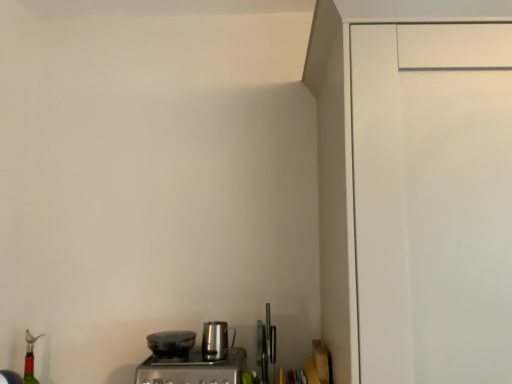
The image size is (512, 384). What do you see at coordinates (30, 359) in the screenshot?
I see `translucent red glass bottle at lower left` at bounding box center [30, 359].

What is the approximate height of translucent red glass bottle at lower left?

16.38 inches.

Measure the distance between stainless steel kettle at center, which appears as the first kitchen appliance when viewed from the right, and camera.

stainless steel kettle at center, which appears as the first kitchen appliance when viewed from the right, is 4.30 feet from camera.

Where is `stainless steel kettle at center, arranged as the 2th kitchen appliance when viewed from the left`? This screenshot has width=512, height=384. stainless steel kettle at center, arranged as the 2th kitchen appliance when viewed from the left is located at coordinates (216, 340).

I want to click on shiny black pot at lower center, the 2th kitchen appliance in the right-to-left sequence, so click(170, 344).

The image size is (512, 384). In order to click on translucent red glass bottle at lower left in this screenshot , I will do `click(30, 359)`.

Which object is thinner, translucent red glass bottle at lower left or stainless steel coffee maker at lower center?

With smaller width is translucent red glass bottle at lower left.

Is point (25, 337) closer or farther from the camera than point (155, 360)?

Clearly, point (25, 337) is more distant from the camera than point (155, 360).

This screenshot has width=512, height=384. In order to click on bottle below the stainless steel coffee maker at lower center (from the image's perspective) in this screenshot , I will do `click(30, 359)`.

Can you confirm if translucent red glass bottle at lower left is shorter than stainless steel coffee maker at lower center?

No, translucent red glass bottle at lower left is not shorter than stainless steel coffee maker at lower center.

Which is further, (156, 347) or (32, 382)?

Point (32, 382)

From a real-world perspective, between shiny black pot at lower center, placed as the first kitchen appliance when sorted from left to right, and translucent red glass bottle at lower left, who is vertically lower?

translucent red glass bottle at lower left.

From the image's perspective, count 1st kitchen appliances upward from the translucent red glass bottle at lower left and point to it. Please provide its 2D coordinates.

[(170, 344)]

Which of these two, translucent red glass bottle at lower left or shiny black pot at lower center, placed as the first kitchen appliance when sorted from left to right, stands taller?

translucent red glass bottle at lower left is taller.

Which is less distant, (29,348) or (153,344)?

Point (29,348) is farther from the camera than point (153,344).

Between translucent red glass bottle at lower left and shiny black pot at lower center, the 2th kitchen appliance in the right-to-left sequence, which one has larger size?

With larger size is translucent red glass bottle at lower left.

Is translucent red glass bottle at lower left completely or partially outside of shiny black pot at lower center, placed as the first kitchen appliance when sorted from left to right?

Absolutely, translucent red glass bottle at lower left is external to shiny black pot at lower center, placed as the first kitchen appliance when sorted from left to right.

Is translucent red glass bottle at lower left surrounded by stainless steel coffee maker at lower center?

No, translucent red glass bottle at lower left is located outside of stainless steel coffee maker at lower center.

Is stainless steel coffee maker at lower center aimed at translucent red glass bottle at lower left?

No, stainless steel coffee maker at lower center is not turned towards translucent red glass bottle at lower left.

Does stainless steel coffee maker at lower center have a greater width compared to translucent red glass bottle at lower left?

Indeed, stainless steel coffee maker at lower center has a greater width compared to translucent red glass bottle at lower left.

Who is shorter, stainless steel coffee maker at lower center or translucent red glass bottle at lower left?

Standing shorter between the two is stainless steel coffee maker at lower center.

This screenshot has width=512, height=384. I want to click on bottle below the stainless steel kettle at center, arranged as the 2th kitchen appliance when viewed from the left (from a real-world perspective), so click(30, 359).

Which is more to the left, stainless steel kettle at center, which appears as the first kitchen appliance when viewed from the right, or translucent red glass bottle at lower left?

translucent red glass bottle at lower left is more to the left.

In the scene shown: Considering their positions, is stainless steel kettle at center, which appears as the first kitchen appliance when viewed from the right, located in front of or behind translucent red glass bottle at lower left?

Visually, stainless steel kettle at center, which appears as the first kitchen appliance when viewed from the right, is located in front of translucent red glass bottle at lower left.

Which of these two, stainless steel kettle at center, arranged as the 2th kitchen appliance when viewed from the left, or translucent red glass bottle at lower left, stands shorter?

stainless steel kettle at center, arranged as the 2th kitchen appliance when viewed from the left, is shorter.

From the image's perspective, is shiny black pot at lower center, placed as the first kitchen appliance when sorted from left to right, positioned above or below stainless steel coffee maker at lower center?

shiny black pot at lower center, placed as the first kitchen appliance when sorted from left to right, is above stainless steel coffee maker at lower center.

Which object is further away from the camera, shiny black pot at lower center, placed as the first kitchen appliance when sorted from left to right, or stainless steel coffee maker at lower center?

shiny black pot at lower center, placed as the first kitchen appliance when sorted from left to right.

Is shiny black pot at lower center, placed as the first kitchen appliance when sorted from left to right, facing towards stainless steel coffee maker at lower center?

No, shiny black pot at lower center, placed as the first kitchen appliance when sorted from left to right, is not aimed at stainless steel coffee maker at lower center.

Between shiny black pot at lower center, placed as the first kitchen appliance when sorted from left to right, and stainless steel coffee maker at lower center, which one appears on the left side from the viewer's perspective?

shiny black pot at lower center, placed as the first kitchen appliance when sorted from left to right.

Considering the sizes of objects shiny black pot at lower center, the 2th kitchen appliance in the right-to-left sequence, and stainless steel kettle at center, which appears as the first kitchen appliance when viewed from the right, in the image provided, who is shorter, shiny black pot at lower center, the 2th kitchen appliance in the right-to-left sequence, or stainless steel kettle at center, which appears as the first kitchen appliance when viewed from the right,?

shiny black pot at lower center, the 2th kitchen appliance in the right-to-left sequence.

Considering the positions of objects shiny black pot at lower center, the 2th kitchen appliance in the right-to-left sequence, and stainless steel kettle at center, arranged as the 2th kitchen appliance when viewed from the left, in the image provided, who is more to the right, shiny black pot at lower center, the 2th kitchen appliance in the right-to-left sequence, or stainless steel kettle at center, arranged as the 2th kitchen appliance when viewed from the left,?

stainless steel kettle at center, arranged as the 2th kitchen appliance when viewed from the left, is more to the right.

How distant is shiny black pot at lower center, the 2th kitchen appliance in the right-to-left sequence, from stainless steel kettle at center, which appears as the first kitchen appliance when viewed from the right?

3.90 inches.

Is shiny black pot at lower center, the 2th kitchen appliance in the right-to-left sequence, not close to stainless steel kettle at center, which appears as the first kitchen appliance when viewed from the right?

Actually, shiny black pot at lower center, the 2th kitchen appliance in the right-to-left sequence, and stainless steel kettle at center, which appears as the first kitchen appliance when viewed from the right, are a little close together.

The width and height of the screenshot is (512, 384). I want to click on home appliance above the translucent red glass bottle at lower left (from the image's perspective), so click(x=193, y=369).

Find the location of a particular element. This screenshot has width=512, height=384. bottle on the left of shiny black pot at lower center, placed as the first kitchen appliance when sorted from left to right is located at coordinates (30, 359).

Based on their spatial positions, is translucent red glass bottle at lower left or stainless steel kettle at center, which appears as the first kitchen appliance when viewed from the right, closer to stainless steel coffee maker at lower center?

stainless steel kettle at center, which appears as the first kitchen appliance when viewed from the right, lies closer to stainless steel coffee maker at lower center than the other object.

Based on their spatial positions, is stainless steel coffee maker at lower center or stainless steel kettle at center, which appears as the first kitchen appliance when viewed from the right, further from translucent red glass bottle at lower left?

stainless steel kettle at center, which appears as the first kitchen appliance when viewed from the right, lies further to translucent red glass bottle at lower left than the other object.

Looking at the image, which one is located closer to translucent red glass bottle at lower left, shiny black pot at lower center, the 2th kitchen appliance in the right-to-left sequence, or stainless steel coffee maker at lower center?

shiny black pot at lower center, the 2th kitchen appliance in the right-to-left sequence.

Estimate the real-world distances between objects in this image. Which object is closer to translucent red glass bottle at lower left, stainless steel kettle at center, which appears as the first kitchen appliance when viewed from the right, or stainless steel coffee maker at lower center?

stainless steel coffee maker at lower center is positioned closer to the anchor translucent red glass bottle at lower left.

Which object lies nearer to the anchor point shiny black pot at lower center, the 2th kitchen appliance in the right-to-left sequence, stainless steel kettle at center, which appears as the first kitchen appliance when viewed from the right, or translucent red glass bottle at lower left?

Among the two, stainless steel kettle at center, which appears as the first kitchen appliance when viewed from the right, is located nearer to shiny black pot at lower center, the 2th kitchen appliance in the right-to-left sequence.

Which object lies further to the anchor point shiny black pot at lower center, placed as the first kitchen appliance when sorted from left to right, stainless steel kettle at center, which appears as the first kitchen appliance when viewed from the right, or stainless steel coffee maker at lower center?

The object further to shiny black pot at lower center, placed as the first kitchen appliance when sorted from left to right, is stainless steel kettle at center, which appears as the first kitchen appliance when viewed from the right.

When comparing their distances from stainless steel kettle at center, arranged as the 2th kitchen appliance when viewed from the left, does translucent red glass bottle at lower left or shiny black pot at lower center, the 2th kitchen appliance in the right-to-left sequence, seem closer?

Based on the image, shiny black pot at lower center, the 2th kitchen appliance in the right-to-left sequence, appears to be nearer to stainless steel kettle at center, arranged as the 2th kitchen appliance when viewed from the left.

When comparing their distances from translucent red glass bottle at lower left, does stainless steel coffee maker at lower center or shiny black pot at lower center, placed as the first kitchen appliance when sorted from left to right, seem closer?

shiny black pot at lower center, placed as the first kitchen appliance when sorted from left to right, lies closer to translucent red glass bottle at lower left than the other object.

You are a GUI agent. You are given a task and a screenshot of the screen. Output one action in this format:
    pyautogui.click(x=<x>, y=<y>)
    Task: Click on the kitchen appliance located between translucent red glass bottle at lower left and stainless steel kettle at center, which appears as the first kitchen appliance when viewed from the right, in the left-right direction
    Image resolution: width=512 pixels, height=384 pixels.
    Given the screenshot: What is the action you would take?
    pyautogui.click(x=170, y=344)

The width and height of the screenshot is (512, 384). Find the location of `kitchen appliance between stainless steel kettle at center, arranged as the 2th kitchen appliance when viewed from the left, and stainless steel coffee maker at lower center from top to bottom`. kitchen appliance between stainless steel kettle at center, arranged as the 2th kitchen appliance when viewed from the left, and stainless steel coffee maker at lower center from top to bottom is located at coordinates (170, 344).

At what (x,y) coordinates should I click in order to perform the action: click on kitchen appliance situated between translucent red glass bottle at lower left and stainless steel coffee maker at lower center from left to right. Please return your answer as a coordinate pair (x, y). The height and width of the screenshot is (384, 512). Looking at the image, I should click on (170, 344).

The height and width of the screenshot is (384, 512). Identify the location of home appliance between translucent red glass bottle at lower left and stainless steel kettle at center, which appears as the first kitchen appliance when viewed from the right, in the horizontal direction. tap(193, 369).